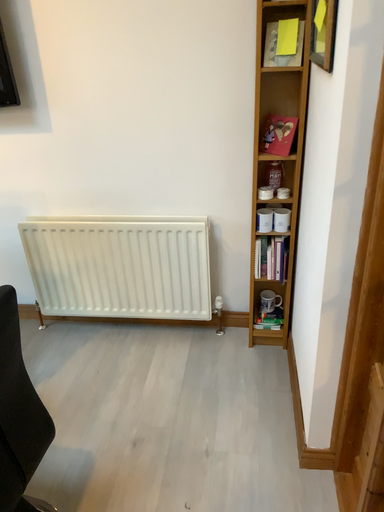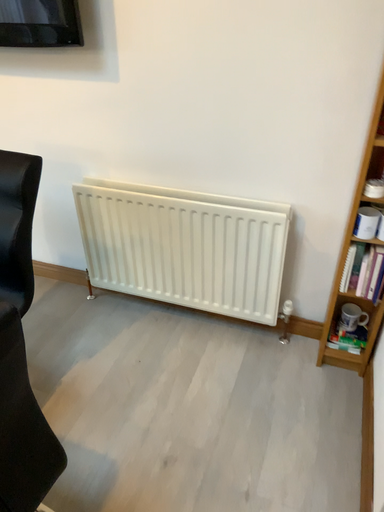
Question: Which way did the camera rotate in the video?

Choices:
 (A) rotated left
 (B) rotated right

Answer: (A)